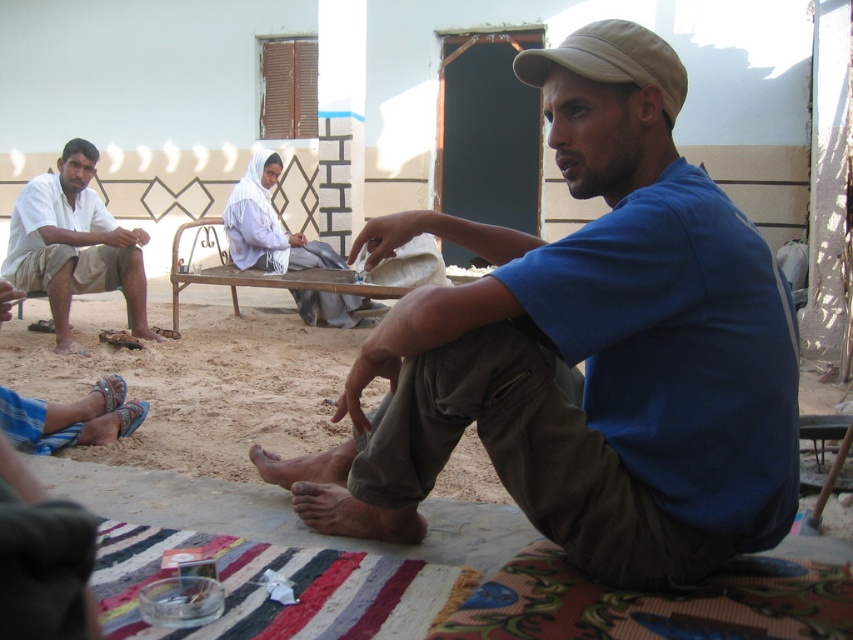
Based on the photo, you are standing at the center of the scene and want to reach the white cotton shirt at left. Which direction should you move to get there?

You should move to the left to reach the white cotton shirt at left since it is positioned at point 0.383 on the x axis, which is to the left of the center.